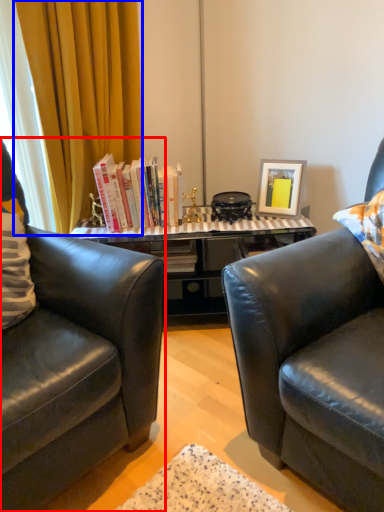
Question: Which object is closer to the camera taking this photo, chair (highlighted by a red box) or curtain (highlighted by a blue box)?

Choices:
 (A) chair
 (B) curtain

Answer: (A)